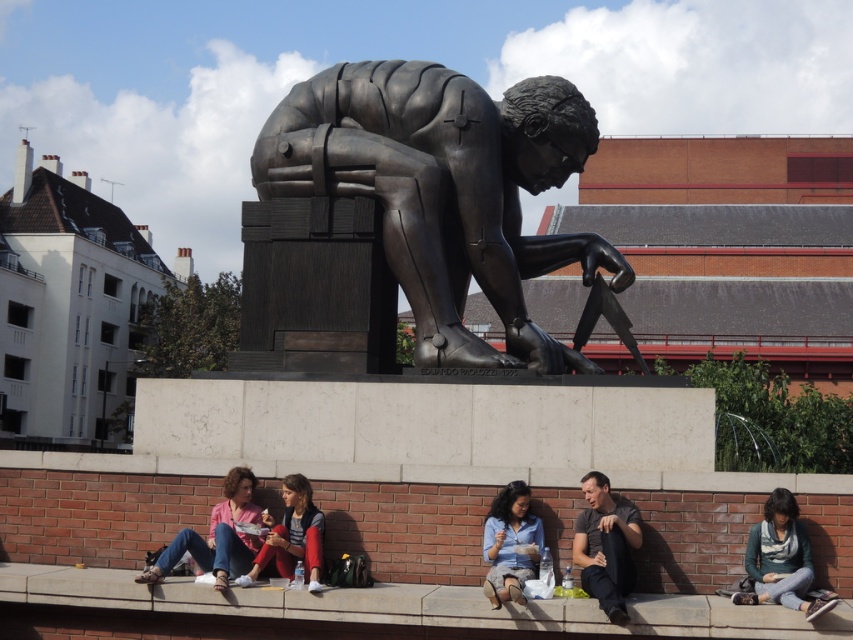
You are a photographer standing at the back of the scene. You want to take a photo of the denim jacket at lower right and the dark gray fabric shirt at lower center without any obstruction. Which object should you adjust to avoid blocking the view?

The denim jacket at lower right is positioned under the dark gray fabric shirt at lower center. To avoid obstruction, you should adjust the denim jacket at lower right since it is beneath the dark gray fabric shirt at lower center and might be blocking the view.

Based on the photo, you are standing at the point where the sculpture is located. Which object is exactly at the coordinates point (781,560)?

The denim jacket at lower right is exactly at the coordinates point (781,560).